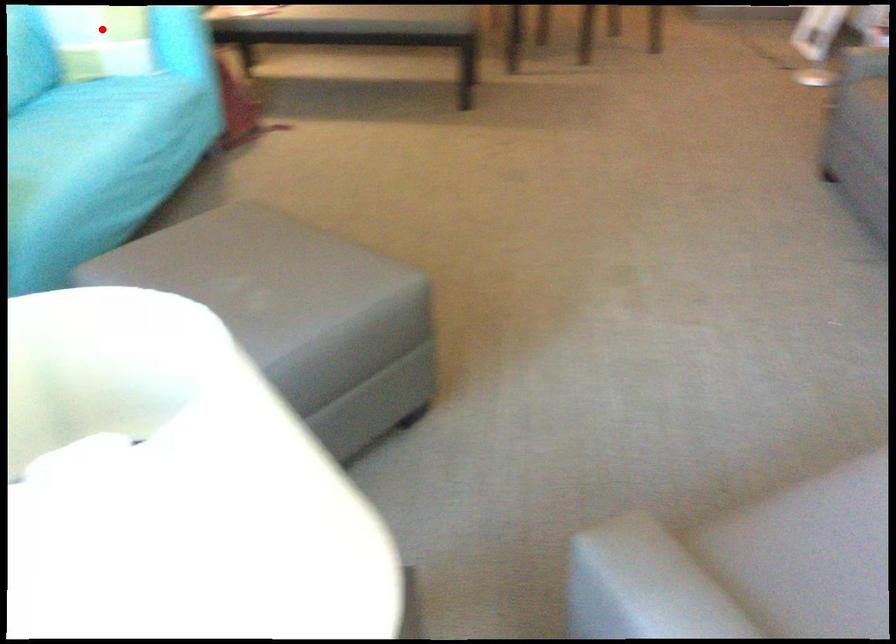
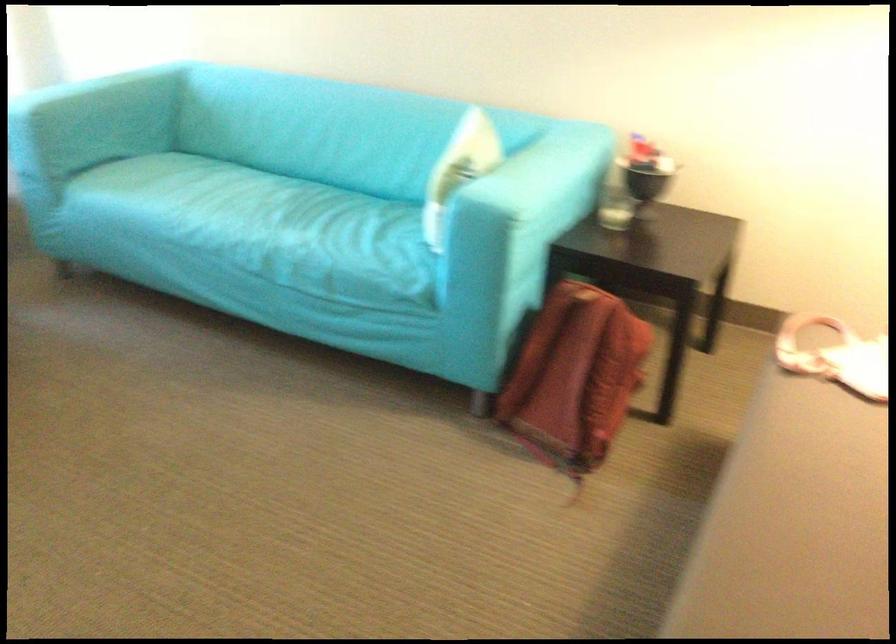
Question: I am providing you with two images of the same scene from different viewpoints. A red point is marked on the first image. Can you still see the location of the red point in image 2?

Choices:
 (A) Yes
 (B) No

Answer: (B)